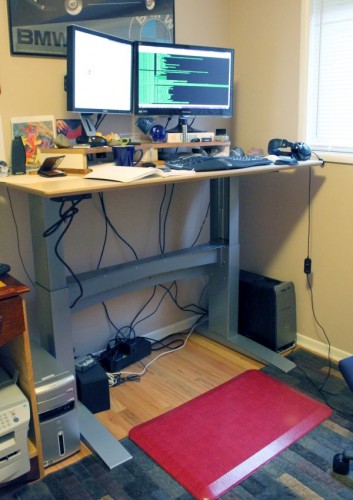
Identify the location of printer. (4, 405).